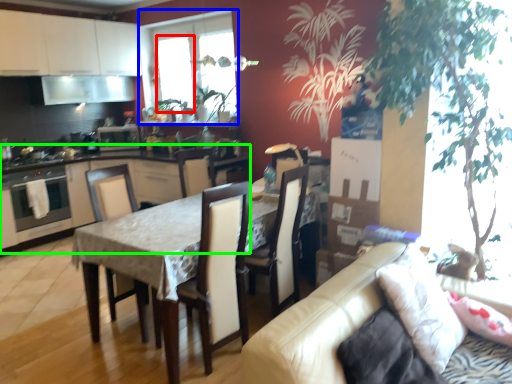
Question: Estimate the real-world distances between objects in this image. Which object is farther from window screen (highlighted by a red box), window (highlighted by a blue box) or cabinetry (highlighted by a green box)?

Choices:
 (A) window
 (B) cabinetry

Answer: (B)